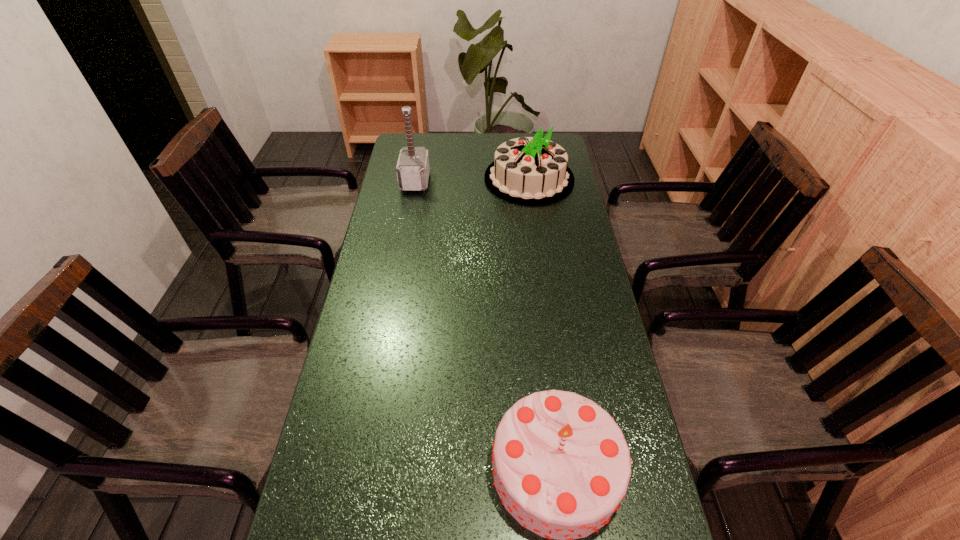
The width and height of the screenshot is (960, 540). In order to click on free point at the left edge in this screenshot , I will do `click(378, 397)`.

Where is `free region at the far left corner of the desktop`? The width and height of the screenshot is (960, 540). free region at the far left corner of the desktop is located at coordinates (421, 137).

Find the location of a particular element. This screenshot has width=960, height=540. free space between the farther birthday cake and the tallest object is located at coordinates (472, 180).

The height and width of the screenshot is (540, 960). What are the coordinates of `vacant area that lies between the hammer and the farther birthday cake` in the screenshot? It's located at (472, 180).

At what (x,y) coordinates should I click in order to perform the action: click on the second closest object to the hammer. Please return your answer as a coordinate pair (x, y). This screenshot has height=540, width=960. Looking at the image, I should click on (561, 465).

Identify which object is the nearest to the tallest object. Please provide its 2D coordinates. Your answer should be formatted as a tuple, i.e. [(x, y)], where the tuple contains the x and y coordinates of a point satisfying the conditions above.

[(532, 171)]

You are a GUI agent. You are given a task and a screenshot of the screen. Output one action in this format:
    pyautogui.click(x=<x>, y=<y>)
    Task: Click on the vacant space that satisfies the following two spatial constraints: 1. on the front side of the farther birthday cake; 2. for striking with the head of the hammer
    The width and height of the screenshot is (960, 540).
    Given the screenshot: What is the action you would take?
    pyautogui.click(x=529, y=181)

Find the location of `vacant space that satisfies the following two spatial constraints: 1. on the front side of the farther birthday cake; 2. for striking with the head of the hammer`. vacant space that satisfies the following two spatial constraints: 1. on the front side of the farther birthday cake; 2. for striking with the head of the hammer is located at coordinates (529, 181).

Find the location of a particular element. The height and width of the screenshot is (540, 960). vacant position in the image that satisfies the following two spatial constraints: 1. on the front side of the farther birthday cake; 2. for striking with the head of the leftmost object is located at coordinates (529, 181).